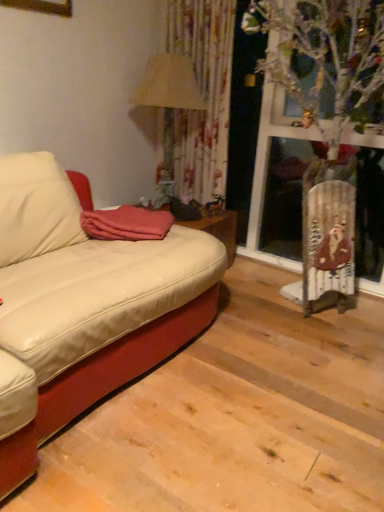
Where is `coral fleece blanket at center`? This screenshot has width=384, height=512. coral fleece blanket at center is located at coordinates (126, 224).

Measure the distance between coral fleece blanket at center and camera.

A distance of 2.01 meters exists between coral fleece blanket at center and camera.

What do you see at coordinates (126, 224) in the screenshot? The height and width of the screenshot is (512, 384). I see `coral fleece blanket at center` at bounding box center [126, 224].

You are a GUI agent. You are given a task and a screenshot of the screen. Output one action in this format:
    pyautogui.click(x=<x>, y=<y>)
    Task: Click on the beige fabric lampshade at upper center
    This screenshot has height=512, width=384.
    Given the screenshot: What is the action you would take?
    pyautogui.click(x=168, y=106)

What do you see at coordinates (168, 106) in the screenshot? The height and width of the screenshot is (512, 384). I see `beige fabric lampshade at upper center` at bounding box center [168, 106].

Where is `coral fleece blanket at center`? coral fleece blanket at center is located at coordinates [126, 224].

Considering the positions of objects coral fleece blanket at center and beige fabric lampshade at upper center in the image provided, who is more to the right, coral fleece blanket at center or beige fabric lampshade at upper center?

beige fabric lampshade at upper center.

Between coral fleece blanket at center and beige fabric lampshade at upper center, which one is positioned in front?

coral fleece blanket at center is in front.

Which is behind, point (158, 220) or point (168, 104)?

Positioned behind is point (168, 104).

From the image's perspective, between coral fleece blanket at center and beige fabric lampshade at upper center, who is located below?

coral fleece blanket at center is shown below in the image.

From a real-world perspective, who is located lower, coral fleece blanket at center or beige fabric lampshade at upper center?

From a 3D spatial view, coral fleece blanket at center is below.

Which of these two, coral fleece blanket at center or beige fabric lampshade at upper center, is wider?

Wider between the two is coral fleece blanket at center.

Who is taller, coral fleece blanket at center or beige fabric lampshade at upper center?

beige fabric lampshade at upper center is taller.

Can you confirm if coral fleece blanket at center is smaller than beige fabric lampshade at upper center?

A: Yes, coral fleece blanket at center is smaller than beige fabric lampshade at upper center.

Based on the photo, can we say coral fleece blanket at center lies outside beige fabric lampshade at upper center?

coral fleece blanket at center lies outside beige fabric lampshade at upper center's area.

Is coral fleece blanket at center with beige fabric lampshade at upper center?

No, coral fleece blanket at center is not beside beige fabric lampshade at upper center.

Is coral fleece blanket at center oriented away from beige fabric lampshade at upper center?

No.

How many degrees apart are the facing directions of coral fleece blanket at center and beige fabric lampshade at upper center?

46.5 degrees.

The height and width of the screenshot is (512, 384). Identify the location of blanket in front of the beige fabric lampshade at upper center. (126, 224).

Between beige fabric lampshade at upper center and coral fleece blanket at center, which one appears on the left side from the viewer's perspective?

coral fleece blanket at center is more to the left.

Does beige fabric lampshade at upper center come in front of coral fleece blanket at center?

No, beige fabric lampshade at upper center is further to the viewer.

Between point (187, 94) and point (135, 213), which one is positioned in front?

The point (135, 213) is more forward.

From the image's perspective, who appears lower, beige fabric lampshade at upper center or coral fleece blanket at center?

coral fleece blanket at center.

Looking at this image, from a real-world perspective, is beige fabric lampshade at upper center positioned above or below coral fleece blanket at center?

In terms of real-world spatial position, beige fabric lampshade at upper center is above coral fleece blanket at center.

Considering the relative sizes of beige fabric lampshade at upper center and coral fleece blanket at center in the image provided, is beige fabric lampshade at upper center thinner than coral fleece blanket at center?

Yes.

In terms of height, does beige fabric lampshade at upper center look taller or shorter compared to coral fleece blanket at center?

Clearly, beige fabric lampshade at upper center is taller compared to coral fleece blanket at center.

Considering the sizes of objects beige fabric lampshade at upper center and coral fleece blanket at center in the image provided, who is bigger, beige fabric lampshade at upper center or coral fleece blanket at center?

beige fabric lampshade at upper center is bigger.

Is coral fleece blanket at center completely or partially inside beige fabric lampshade at upper center?

No, coral fleece blanket at center is not surrounded by beige fabric lampshade at upper center.

Is beige fabric lampshade at upper center with coral fleece blanket at center?

They are not placed beside each other.

Is beige fabric lampshade at upper center oriented away from coral fleece blanket at center?

beige fabric lampshade at upper center is not turned away from coral fleece blanket at center.

How many degrees apart are the facing directions of beige fabric lampshade at upper center and coral fleece blanket at center?

They differ by 46.5 degrees in their facing directions.

At what (x,y) coordinates should I click in order to perform the action: click on lamp on the right of coral fleece blanket at center. Please return your answer as a coordinate pair (x, y). The image size is (384, 512). Looking at the image, I should click on (168, 106).

Identify the location of lamp that appears above the coral fleece blanket at center (from the image's perspective). The width and height of the screenshot is (384, 512). (168, 106).

At what (x,y) coordinates should I click in order to perform the action: click on blanket below the beige fabric lampshade at upper center (from a real-world perspective). Please return your answer as a coordinate pair (x, y). Looking at the image, I should click on (126, 224).